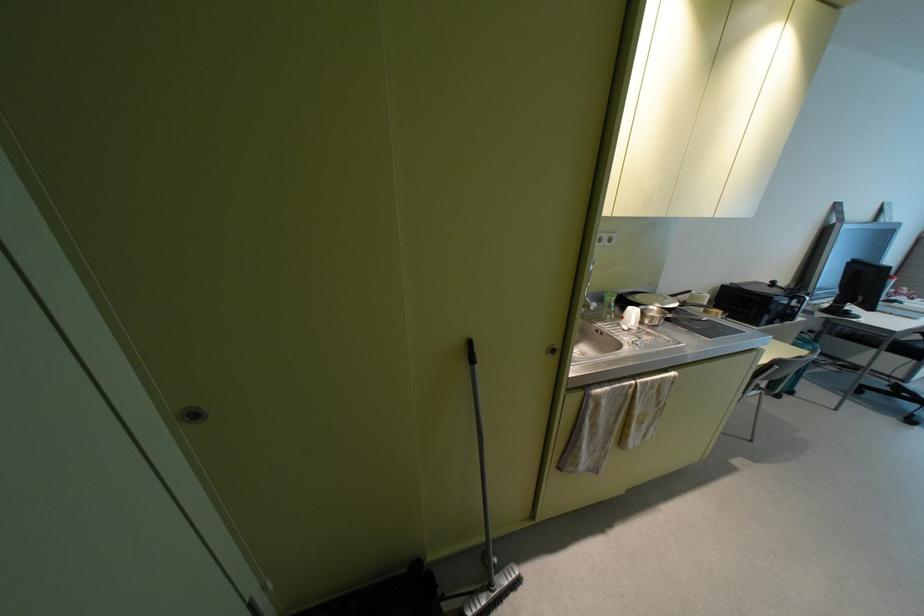
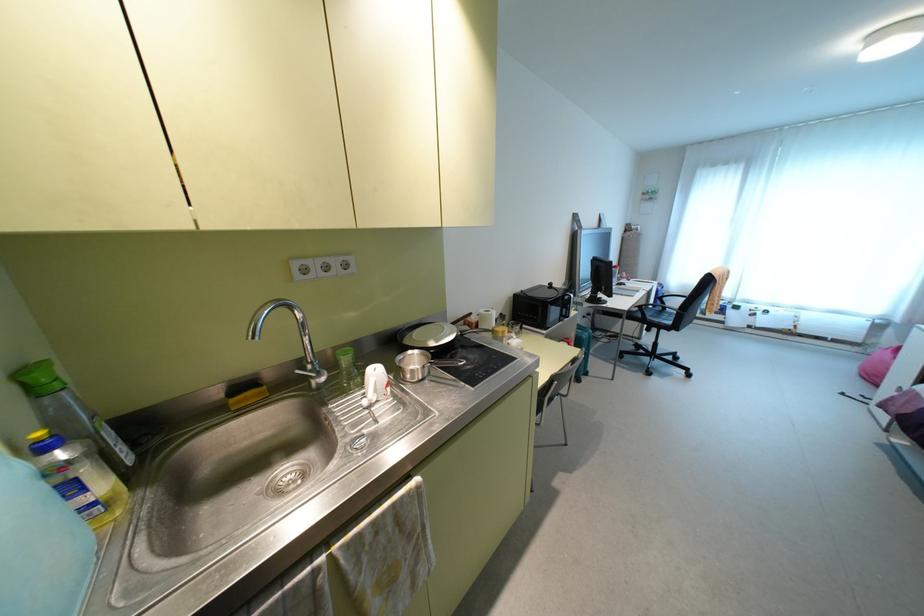
In a continuous first-person perspective shot, in which direction is the camera moving?

The movement direction of the cameraman is right, forward.